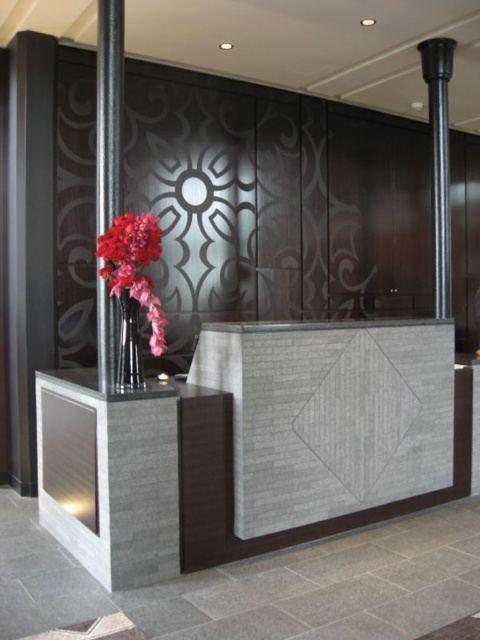
What do you see at coordinates (439, 163) in the screenshot? The image size is (480, 640). I see `polished metal pole at upper right` at bounding box center [439, 163].

Which is below, polished metal pole at upper right or matte glass vase at left?

matte glass vase at left is lower down.

Is point (448, 310) closer to viewer compared to point (132, 272)?

That is False.

Where is `polished metal pole at upper right`? polished metal pole at upper right is located at coordinates (439, 163).

Who is lower down, black polished column at left or shiny metallic vase at center?

Positioned lower is shiny metallic vase at center.

Who is more forward, [103,122] or [131,372]?

Point [131,372] is in front.

This screenshot has width=480, height=640. Identify the location of black polished column at left. (108, 112).

Is the position of polished metal pole at upper right less distant than that of shiny metallic vase at center?

No, it is not.

Is polished metal pole at upper right to the left of shiny metallic vase at center from the viewer's perspective?

Incorrect, polished metal pole at upper right is not on the left side of shiny metallic vase at center.

Between point (442, 314) and point (126, 348), which one is positioned in front?

Point (126, 348) is more forward.

At what (x,y) coordinates should I click in order to perform the action: click on polished metal pole at upper right. Please return your answer as a coordinate pair (x, y). The width and height of the screenshot is (480, 640). Looking at the image, I should click on (439, 163).